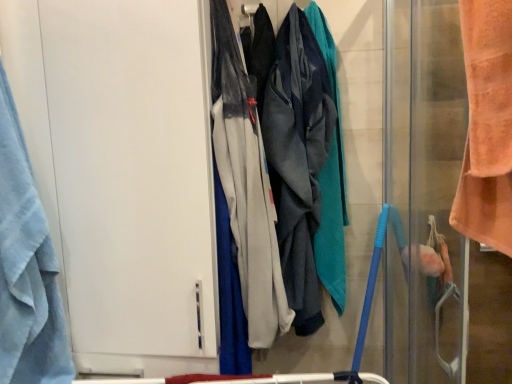
Measure the distance between point (x=389, y=295) and camera.

A distance of 4.82 feet exists between point (x=389, y=295) and camera.

What are the coordinates of `white matte door at left, positioned as the 1th screen door in left-to-right order` in the screenshot? It's located at (133, 181).

The width and height of the screenshot is (512, 384). What are the coordinates of `textured gray hoodie at center, the first wide viewed from the back` in the screenshot? It's located at (298, 158).

This screenshot has height=384, width=512. Describe the element at coordinates (298, 158) in the screenshot. I see `textured gray hoodie at center, which is the second wide from front to back` at that location.

At what (x,y) coordinates should I click in order to perform the action: click on blue terry cloth towel at left. Please return your answer as a coordinate pair (x, y). The image size is (512, 384). Looking at the image, I should click on (26, 267).

How many degrees apart are the facing directions of white matte door at left, positioned as the 1th screen door in left-to-right order, and blue terry cloth towel at left?

1.24 degrees separate the facing orientations of white matte door at left, positioned as the 1th screen door in left-to-right order, and blue terry cloth towel at left.

From the image's perspective, is white matte door at left, the second screen door when ordered from right to left, below blue terry cloth towel at left?

No, from the image's perspective, white matte door at left, the second screen door when ordered from right to left, is not below blue terry cloth towel at left.

In the scene shown: Is white matte door at left, the second screen door when ordered from right to left, inside the boundaries of blue terry cloth towel at left, or outside?

white matte door at left, the second screen door when ordered from right to left, is not enclosed by blue terry cloth towel at left.

Considering the sizes of gray fabric pants at center, which is the second wide in back-to-front order, and orange towel at right, which appears as the first screen door when viewed from the right, in the image, is gray fabric pants at center, which is the second wide in back-to-front order, taller or shorter than orange towel at right, which appears as the first screen door when viewed from the right,?

Clearly, gray fabric pants at center, which is the second wide in back-to-front order, is shorter compared to orange towel at right, which appears as the first screen door when viewed from the right.

Considering the positions of objects gray fabric pants at center, which is the second wide in back-to-front order, and orange towel at right, positioned as the second screen door in left-to-right order, in the image provided, who is in front, gray fabric pants at center, which is the second wide in back-to-front order, or orange towel at right, positioned as the second screen door in left-to-right order,?

Positioned in front is orange towel at right, positioned as the second screen door in left-to-right order.

Based on the photo, would you consider gray fabric pants at center, the 1th wide when ordered from front to back, to be distant from orange towel at right, which appears as the first screen door when viewed from the right?

They are positioned close to each other.

Can orange towel at right, positioned as the second screen door in left-to-right order, be found inside gray fabric pants at center, the 1th wide when ordered from front to back?

That's incorrect, orange towel at right, positioned as the second screen door in left-to-right order, is not inside gray fabric pants at center, the 1th wide when ordered from front to back.

In the image, is blue terry cloth towel at left positioned in front of or behind white matte door at left, positioned as the 1th screen door in left-to-right order?

blue terry cloth towel at left is positioned closer to the viewer than white matte door at left, positioned as the 1th screen door in left-to-right order.

In terms of size, does blue terry cloth towel at left appear bigger or smaller than white matte door at left, the second screen door when ordered from right to left?

In the image, blue terry cloth towel at left appears to be smaller than white matte door at left, the second screen door when ordered from right to left.

This screenshot has height=384, width=512. Identify the location of towel that appears on the left of white matte door at left, positioned as the 1th screen door in left-to-right order. (26, 267).

Is blue terry cloth towel at left located outside white matte door at left, the second screen door when ordered from right to left?

Yes, blue terry cloth towel at left is not within white matte door at left, the second screen door when ordered from right to left.

Would you say textured gray hoodie at center, the first wide viewed from the back, is a long distance from orange towel at right, which appears as the first screen door when viewed from the right?

That's not correct — textured gray hoodie at center, the first wide viewed from the back, is a little close to orange towel at right, which appears as the first screen door when viewed from the right.

Is textured gray hoodie at center, the first wide viewed from the back, not inside orange towel at right, which appears as the first screen door when viewed from the right?

That's correct, textured gray hoodie at center, the first wide viewed from the back, is outside of orange towel at right, which appears as the first screen door when viewed from the right.

In the scene shown: From the image's perspective, would you say textured gray hoodie at center, the first wide viewed from the back, is shown under orange towel at right, which appears as the first screen door when viewed from the right?

No, from the image's perspective, textured gray hoodie at center, the first wide viewed from the back, is not beneath orange towel at right, which appears as the first screen door when viewed from the right.

Based on the photo, which object is wider, textured gray hoodie at center, which is the second wide from front to back, or orange towel at right, positioned as the second screen door in left-to-right order?

With larger width is textured gray hoodie at center, which is the second wide from front to back.

Looking at this image, is textured gray hoodie at center, the first wide viewed from the back, at the left side of blue terry cloth towel at left?

Incorrect, textured gray hoodie at center, the first wide viewed from the back, is not on the left side of blue terry cloth towel at left.

Is textured gray hoodie at center, the first wide viewed from the back, facing away from blue terry cloth towel at left?

No, blue terry cloth towel at left is not at the back of textured gray hoodie at center, the first wide viewed from the back.

Is textured gray hoodie at center, the first wide viewed from the back, not inside blue terry cloth towel at left?

Yes.

Considering the sizes of objects textured gray hoodie at center, the first wide viewed from the back, and blue terry cloth towel at left in the image provided, who is bigger, textured gray hoodie at center, the first wide viewed from the back, or blue terry cloth towel at left?

Bigger between the two is textured gray hoodie at center, the first wide viewed from the back.

Is the depth of orange towel at right, positioned as the second screen door in left-to-right order, less than that of textured gray hoodie at center, which is the second wide from front to back?

Yes, orange towel at right, positioned as the second screen door in left-to-right order, is closer to the camera.

Identify the location of the 1st wide counting from the left side of the orange towel at right, positioned as the second screen door in left-to-right order. The width and height of the screenshot is (512, 384). (298, 158).

Looking at their sizes, would you say orange towel at right, which appears as the first screen door when viewed from the right, is wider or thinner than textured gray hoodie at center, which is the second wide from front to back?

Considering their sizes, orange towel at right, which appears as the first screen door when viewed from the right, looks slimmer than textured gray hoodie at center, which is the second wide from front to back.

Does orange towel at right, which appears as the first screen door when viewed from the right, have a greater height compared to textured gray hoodie at center, which is the second wide from front to back?

Correct, orange towel at right, which appears as the first screen door when viewed from the right, is much taller as textured gray hoodie at center, which is the second wide from front to back.

Are white matte door at left, positioned as the 1th screen door in left-to-right order, and textured gray hoodie at center, the first wide viewed from the back, far apart?

white matte door at left, positioned as the 1th screen door in left-to-right order, is near textured gray hoodie at center, the first wide viewed from the back, not far away.

Which of these two, white matte door at left, the second screen door when ordered from right to left, or textured gray hoodie at center, the first wide viewed from the back, stands taller?

white matte door at left, the second screen door when ordered from right to left, is taller.

From a real-world perspective, which is physically below, white matte door at left, positioned as the 1th screen door in left-to-right order, or textured gray hoodie at center, which is the second wide from front to back?

From a 3D spatial view, textured gray hoodie at center, which is the second wide from front to back, is below.

Does point (209, 284) come farther from viewer compared to point (293, 230)?

No, it is not.

There is a blue terry cloth towel at left. At what (x,y) coordinates should I click in order to perform the action: click on screen door above it (from a real-world perspective). Please return your answer as a coordinate pair (x, y). Looking at the image, I should click on (133, 181).

The width and height of the screenshot is (512, 384). What are the coordinates of `screen door that appears on the right of gray fabric pants at center, the 1th wide when ordered from front to back` in the screenshot? It's located at (436, 213).

Which object lies nearer to the anchor point textured gray hoodie at center, which is the second wide from front to back, blue terry cloth towel at left or orange towel at right, which appears as the first screen door when viewed from the right?

orange towel at right, which appears as the first screen door when viewed from the right.

Considering their positions, is textured gray hoodie at center, which is the second wide from front to back, positioned closer to gray fabric pants at center, the 1th wide when ordered from front to back, than blue terry cloth towel at left?

The object closer to gray fabric pants at center, the 1th wide when ordered from front to back, is textured gray hoodie at center, which is the second wide from front to back.

When comparing their distances from orange towel at right, which appears as the first screen door when viewed from the right, does textured gray hoodie at center, which is the second wide from front to back, or white matte door at left, positioned as the 1th screen door in left-to-right order, seem further?

Based on the image, white matte door at left, positioned as the 1th screen door in left-to-right order, appears to be further to orange towel at right, which appears as the first screen door when viewed from the right.

In the scene shown: When comparing their distances from gray fabric pants at center, which is the second wide in back-to-front order, does orange towel at right, positioned as the second screen door in left-to-right order, or blue terry cloth towel at left seem further?

blue terry cloth towel at left lies further to gray fabric pants at center, which is the second wide in back-to-front order, than the other object.

Which object lies nearer to the anchor point blue terry cloth towel at left, gray fabric pants at center, the 1th wide when ordered from front to back, or textured gray hoodie at center, the first wide viewed from the back?

Based on the image, gray fabric pants at center, the 1th wide when ordered from front to back, appears to be nearer to blue terry cloth towel at left.

Which object lies nearer to the anchor point gray fabric pants at center, which is the second wide in back-to-front order, white matte door at left, the second screen door when ordered from right to left, or textured gray hoodie at center, which is the second wide from front to back?

textured gray hoodie at center, which is the second wide from front to back, lies closer to gray fabric pants at center, which is the second wide in back-to-front order, than the other object.

When comparing their distances from gray fabric pants at center, which is the second wide in back-to-front order, does blue terry cloth towel at left or white matte door at left, positioned as the 1th screen door in left-to-right order, seem closer?

white matte door at left, positioned as the 1th screen door in left-to-right order, is closer to gray fabric pants at center, which is the second wide in back-to-front order.

Based on their spatial positions, is white matte door at left, positioned as the 1th screen door in left-to-right order, or textured gray hoodie at center, the first wide viewed from the back, closer to orange towel at right, which appears as the first screen door when viewed from the right?

textured gray hoodie at center, the first wide viewed from the back, is closer to orange towel at right, which appears as the first screen door when viewed from the right.

Where is `screen door between blue terry cloth towel at left and orange towel at right, positioned as the second screen door in left-to-right order, in the horizontal direction`? This screenshot has width=512, height=384. screen door between blue terry cloth towel at left and orange towel at right, positioned as the second screen door in left-to-right order, in the horizontal direction is located at coordinates (133, 181).

Where is `screen door situated between blue terry cloth towel at left and gray fabric pants at center, which is the second wide in back-to-front order, from left to right`? The width and height of the screenshot is (512, 384). screen door situated between blue terry cloth towel at left and gray fabric pants at center, which is the second wide in back-to-front order, from left to right is located at coordinates (133, 181).

This screenshot has width=512, height=384. I want to click on wide between blue terry cloth towel at left and textured gray hoodie at center, which is the second wide from front to back, in the horizontal direction, so click(x=246, y=185).

At what (x,y) coordinates should I click in order to perform the action: click on screen door situated between blue terry cloth towel at left and textured gray hoodie at center, which is the second wide from front to back, from left to right. Please return your answer as a coordinate pair (x, y). Looking at the image, I should click on (133, 181).